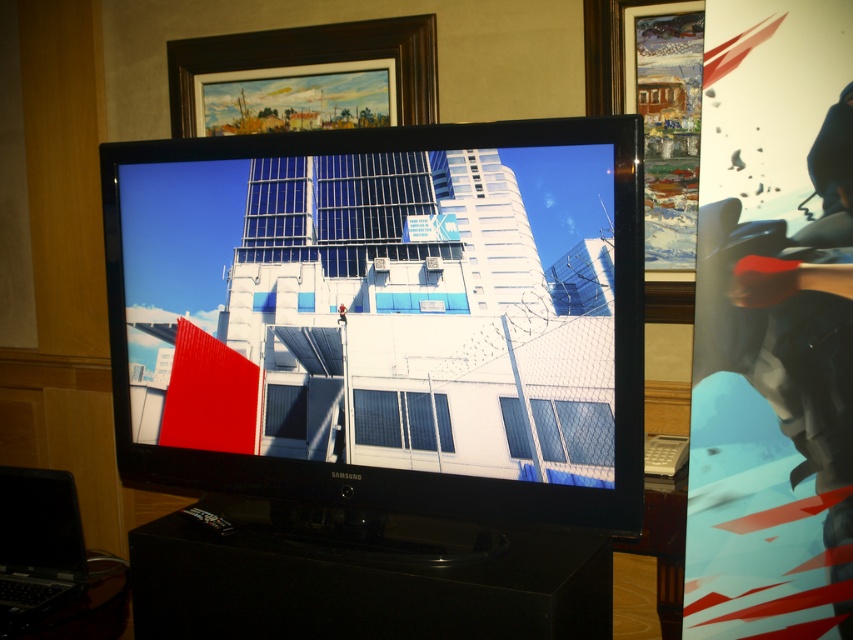
Who is higher up, matte black television at center or dark wood picture frame at upper center?

dark wood picture frame at upper center is above.

Between point (236, 179) and point (409, 36), which one is positioned in front?

Positioned in front is point (236, 179).

This screenshot has width=853, height=640. Identify the location of matte black television at center. (386, 316).

Which of these two, metallic silver motorcycle at right or black matte laptop at lower left, stands shorter?

With less height is black matte laptop at lower left.

Is metallic silver motorcycle at right positioned before black matte laptop at lower left?

Yes.

What do you see at coordinates (773, 332) in the screenshot? This screenshot has width=853, height=640. I see `metallic silver motorcycle at right` at bounding box center [773, 332].

Identify the location of metallic silver motorcycle at right. The image size is (853, 640). pos(773,332).

Who is positioned more to the right, matte black television at center or metallic silver motorcycle at right?

metallic silver motorcycle at right is more to the right.

Between point (293, 390) and point (819, 362), which one is positioned behind?

Point (293, 390)

At what (x,y) coordinates should I click in order to perform the action: click on matte black television at center. Please return your answer as a coordinate pair (x, y). Looking at the image, I should click on (386, 316).